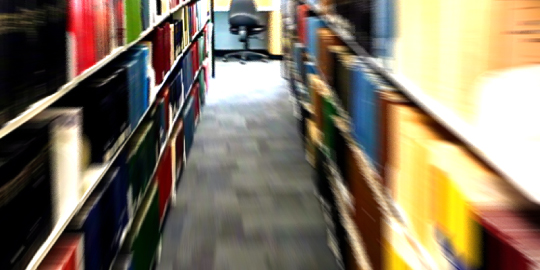
At what (x,y) coordinates should I click in order to perform the action: click on deskt. Please return your answer as a coordinate pair (x, y). This screenshot has height=270, width=540. Looking at the image, I should click on (274, 25).